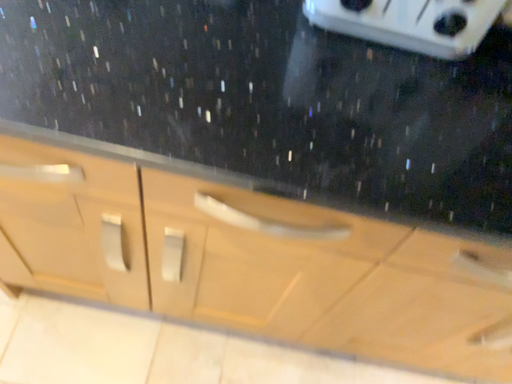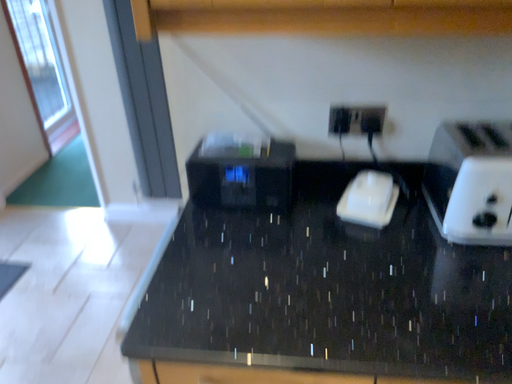
Question: How did the camera likely rotate when shooting the video?

Choices:
 (A) rotated left
 (B) rotated right

Answer: (A)